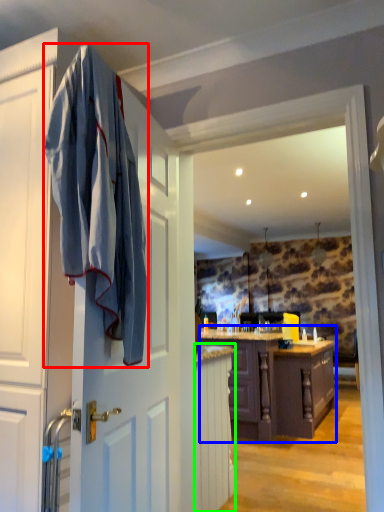
Question: Which is farther away from bath towel (highlighted by a red box)? cabinetry (highlighted by a blue box) or cabinetry (highlighted by a green box)?

Choices:
 (A) cabinetry
 (B) cabinetry

Answer: (A)